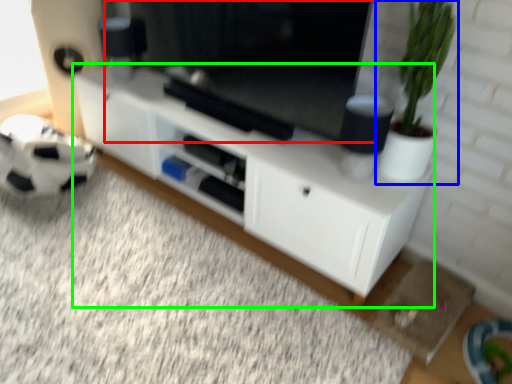
Question: Based on their relative distances, which object is farther from window screen (highlighted by a red box)? Choose from houseplant (highlighted by a blue box) and cabinetry (highlighted by a green box).

Choices:
 (A) houseplant
 (B) cabinetry

Answer: (A)